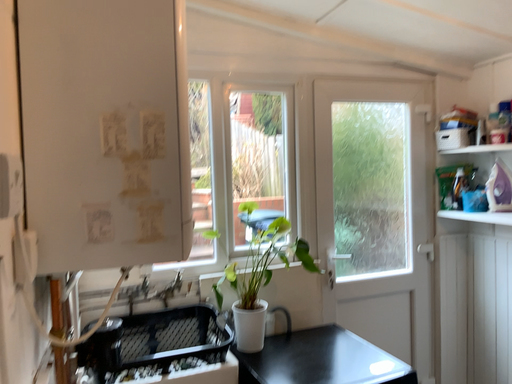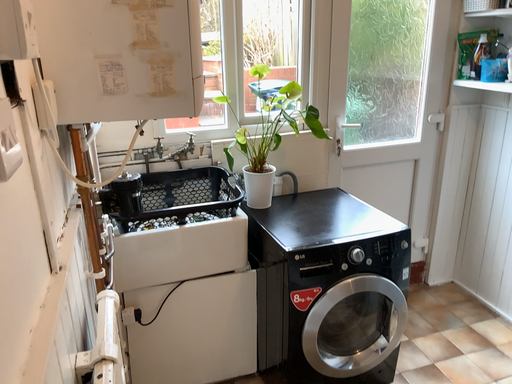
Question: Which way did the camera rotate in the video?

Choices:
 (A) rotated upward
 (B) rotated downward

Answer: (B)